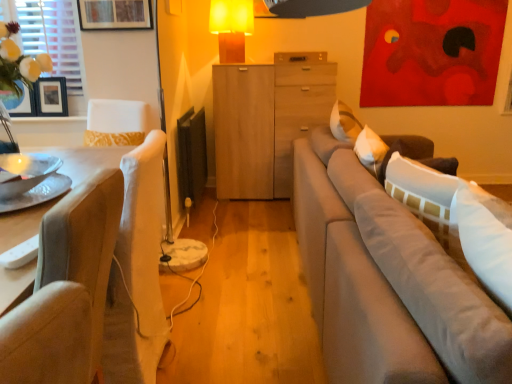
Question: From the image's perspective, is black matte picture frame at left, acting as the 1th picture frame starting from the left, above metallic silver tray at left?

Choices:
 (A) yes
 (B) no

Answer: (A)

Question: Is black matte picture frame at left, the 1th picture frame when ordered from bottom to top, outside of metallic silver tray at left?

Choices:
 (A) no
 (B) yes

Answer: (B)

Question: Is the position of black matte picture frame at left, the 1th picture frame when ordered from bottom to top, less distant than that of metallic silver tray at left?

Choices:
 (A) no
 (B) yes

Answer: (A)

Question: Considering the relative sizes of black matte picture frame at left, the 2th picture frame in the right-to-left sequence, and metallic silver tray at left in the image provided, is black matte picture frame at left, the 2th picture frame in the right-to-left sequence, wider than metallic silver tray at left?

Choices:
 (A) yes
 (B) no

Answer: (B)

Question: Is metallic silver tray at left surrounded by black matte picture frame at left, the 2th picture frame in the right-to-left sequence?

Choices:
 (A) yes
 (B) no

Answer: (B)

Question: Does black matte picture frame at left, the 2th picture frame in the right-to-left sequence, turn towards metallic silver tray at left?

Choices:
 (A) no
 (B) yes

Answer: (B)

Question: From the image's perspective, would you say white fabric window screen at upper left is shown under wooden picture frame at upper left, the second picture frame when ordered from left to right?

Choices:
 (A) no
 (B) yes

Answer: (B)

Question: Is white fabric window screen at upper left in front of wooden picture frame at upper left, placed as the second picture frame when sorted from bottom to top?

Choices:
 (A) yes
 (B) no

Answer: (B)

Question: Can you confirm if white fabric window screen at upper left is positioned to the right of wooden picture frame at upper left, the 1th picture frame when ordered from front to back?

Choices:
 (A) yes
 (B) no

Answer: (B)

Question: Is white fabric window screen at upper left looking in the opposite direction of wooden picture frame at upper left, the 1th picture frame when ordered from front to back?

Choices:
 (A) yes
 (B) no

Answer: (B)

Question: Is the depth of white fabric window screen at upper left greater than that of wooden picture frame at upper left, which appears as the second picture frame when viewed from the back?

Choices:
 (A) yes
 (B) no

Answer: (A)

Question: Is white fabric window screen at upper left shorter than wooden picture frame at upper left, the 1th picture frame when ordered from front to back?

Choices:
 (A) yes
 (B) no

Answer: (B)

Question: Is matte glass vase at left in front of metallic silver tray at left?

Choices:
 (A) yes
 (B) no

Answer: (B)